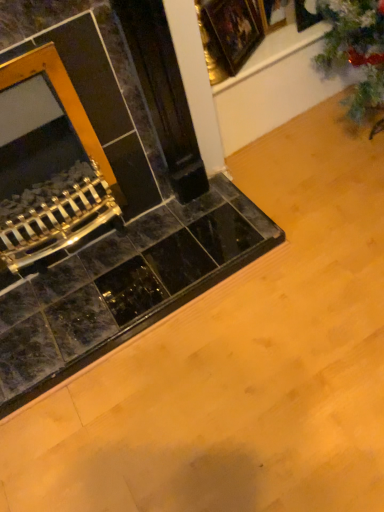
Describe the element at coordinates (230, 32) in the screenshot. The image size is (384, 512). I see `gold/gilded picture frame at upper center` at that location.

Where is `gold/gilded picture frame at upper center`? gold/gilded picture frame at upper center is located at coordinates (230, 32).

Where is `gold/gilded picture frame at upper center`? gold/gilded picture frame at upper center is located at coordinates (230, 32).